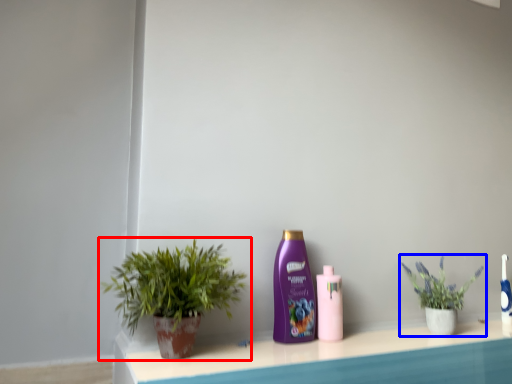
Question: Which of the following is the farthest to the observer, houseplant (highlighted by a red box) or houseplant (highlighted by a blue box)?

Choices:
 (A) houseplant
 (B) houseplant

Answer: (B)